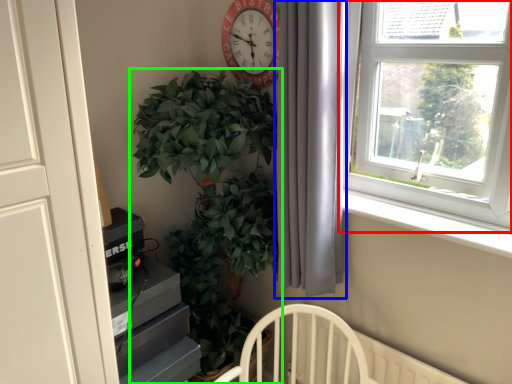
Question: Which object is positioned farthest from window (highlighted by a red box)? Select from curtain (highlighted by a blue box) and houseplant (highlighted by a green box).

Choices:
 (A) curtain
 (B) houseplant

Answer: (B)